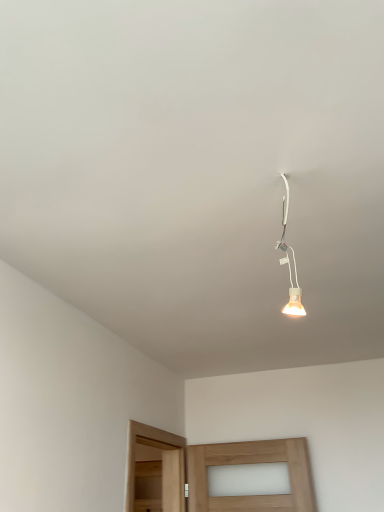
Image resolution: width=384 pixels, height=512 pixels. What do you see at coordinates (289, 262) in the screenshot? I see `white glossy bulb at upper center` at bounding box center [289, 262].

The height and width of the screenshot is (512, 384). In order to click on white glossy bulb at upper center in this screenshot , I will do `click(289, 262)`.

You are a GUI agent. You are given a task and a screenshot of the screen. Output one action in this format:
    pyautogui.click(x=<x>, y=<y>)
    Task: Click on the white glossy bulb at upper center
    
    Given the screenshot: What is the action you would take?
    pyautogui.click(x=289, y=262)